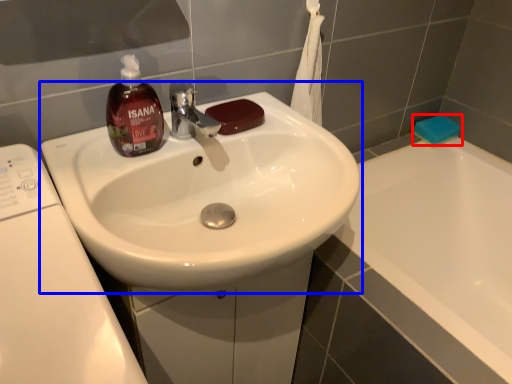
Question: Which object appears closest to the camera in this image, soap (highlighted by a red box) or sink (highlighted by a blue box)?

Choices:
 (A) soap
 (B) sink

Answer: (B)